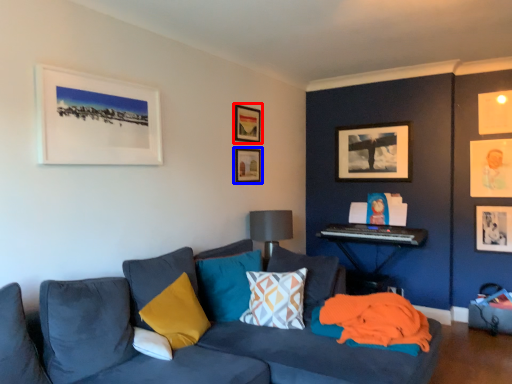
Question: Which object is further to the camera taking this photo, picture frame (highlighted by a red box) or picture frame (highlighted by a blue box)?

Choices:
 (A) picture frame
 (B) picture frame

Answer: (B)